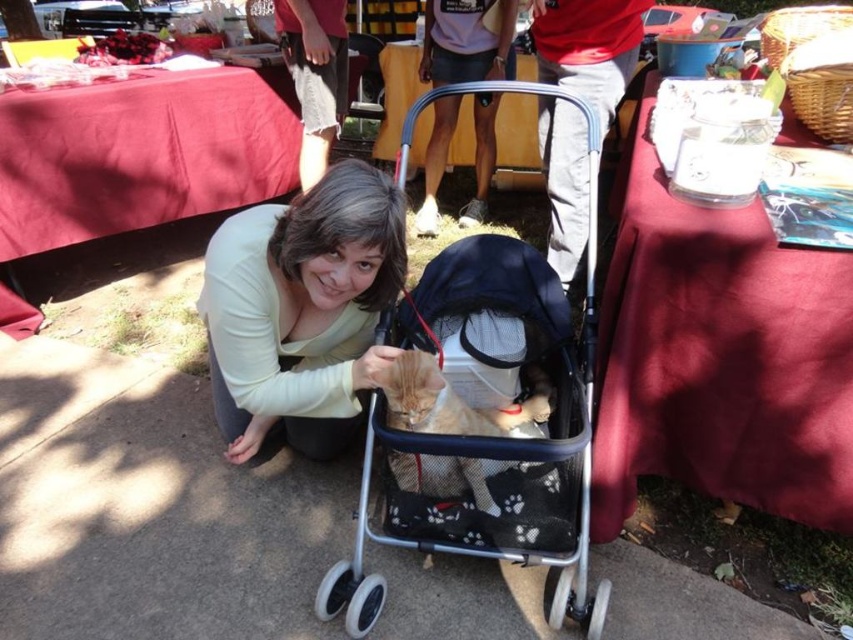
Who is positioned more to the right, smooth red cloth at upper right or orange fur cat at center?

smooth red cloth at upper right is more to the right.

Between point (846, 380) and point (436, 388), which one is positioned in front?

Point (846, 380) is more forward.

Does point (625, 413) come farther from viewer compared to point (440, 429)?

No, it is not.

Where is `smooth red cloth at upper right`? This screenshot has width=853, height=640. smooth red cloth at upper right is located at coordinates [x=718, y=356].

Between metallic silver baby carriage at center and red cloth at upper left, which one is positioned higher?

red cloth at upper left is higher up.

Is metallic silver baby carriage at center taller than red cloth at upper left?

Indeed, metallic silver baby carriage at center has a greater height compared to red cloth at upper left.

Between point (379, 394) and point (91, 212), which one is positioned behind?

Point (91, 212)

What are the coordinates of `metallic silver baby carriage at center` in the screenshot? It's located at (485, 417).

Who is higher up, red cloth at upper left or orange fur cat at center?

Positioned higher is red cloth at upper left.

Does red cloth at upper left have a lesser width compared to orange fur cat at center?

Incorrect, red cloth at upper left's width is not less than orange fur cat at center's.

Who is more distant from viewer, (x=158, y=154) or (x=407, y=465)?

The point (x=158, y=154) is behind.

Locate an element on the screen. red cloth at upper left is located at coordinates (141, 154).